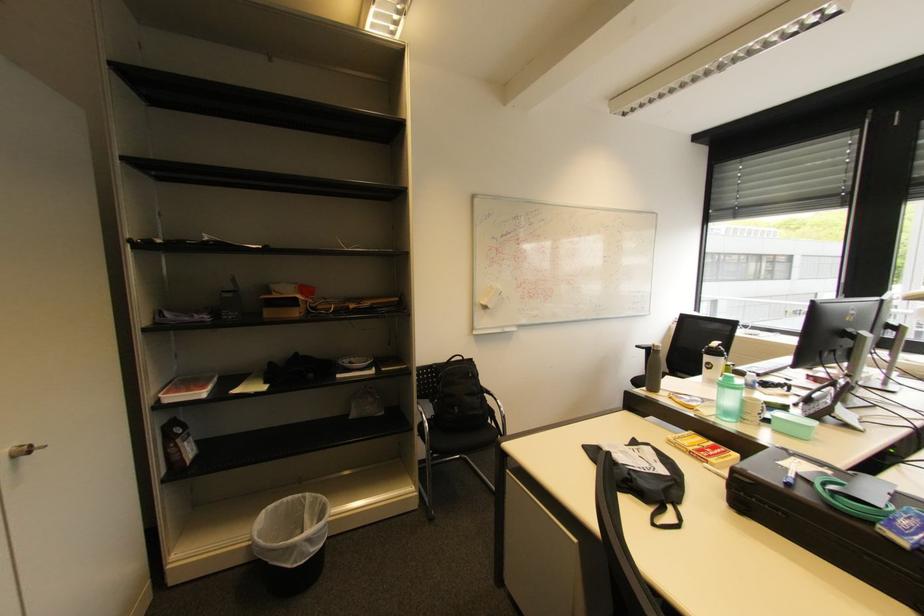
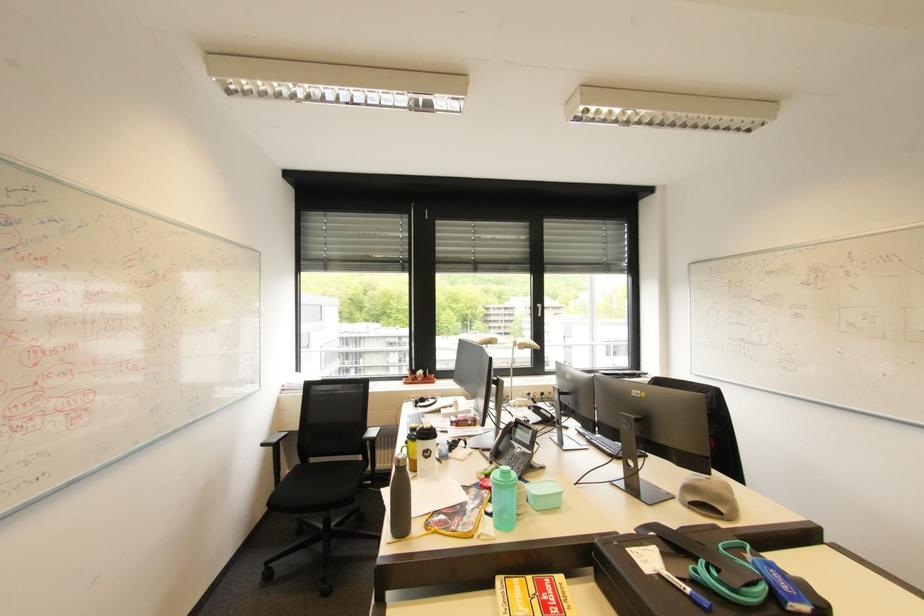
Locate, in the second image, the point that corresponds to point 738,383 in the first image.

(517, 477)